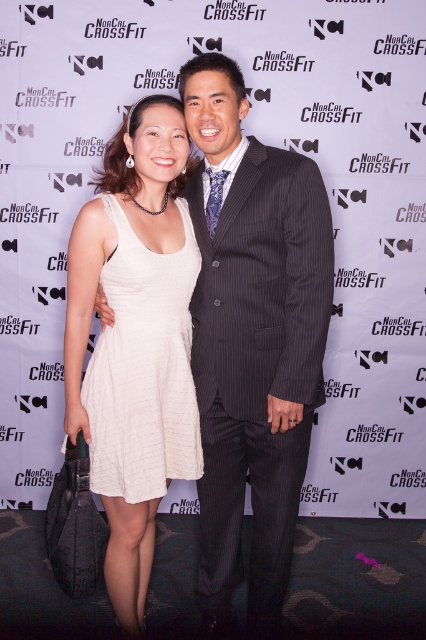
Between point (135, 540) and point (127, 280), which one is positioned in front?

Positioned in front is point (127, 280).

Is point (152, 428) in front of point (172, 326)?

That is True.

This screenshot has width=426, height=640. Describe the element at coordinates (135, 340) in the screenshot. I see `white knit dress at center` at that location.

The height and width of the screenshot is (640, 426). Identify the location of white knit dress at center. (135, 340).

Describe the element at coordinates (253, 336) in the screenshot. The height and width of the screenshot is (640, 426). I see `white satin dress at center` at that location.

You are a GUI agent. You are given a task and a screenshot of the screen. Output one action in this format:
    pyautogui.click(x=<x>, y=<y>)
    Task: Click on the white satin dress at center
    This screenshot has width=426, height=640.
    Given the screenshot: What is the action you would take?
    click(x=253, y=336)

In order to click on white satin dress at center in this screenshot , I will do `click(253, 336)`.

Can you confirm if white satin dress at center is positioned above pinstriped wool suit at center?

Yes, white satin dress at center is above pinstriped wool suit at center.

Who is more distant from viewer, (x=236, y=356) or (x=244, y=358)?

Point (x=236, y=356)

Measure the distance between point (224, 616) and camera.

Point (224, 616) is 6.69 feet away from camera.

The image size is (426, 640). What are the coordinates of `white satin dress at center` in the screenshot? It's located at (253, 336).